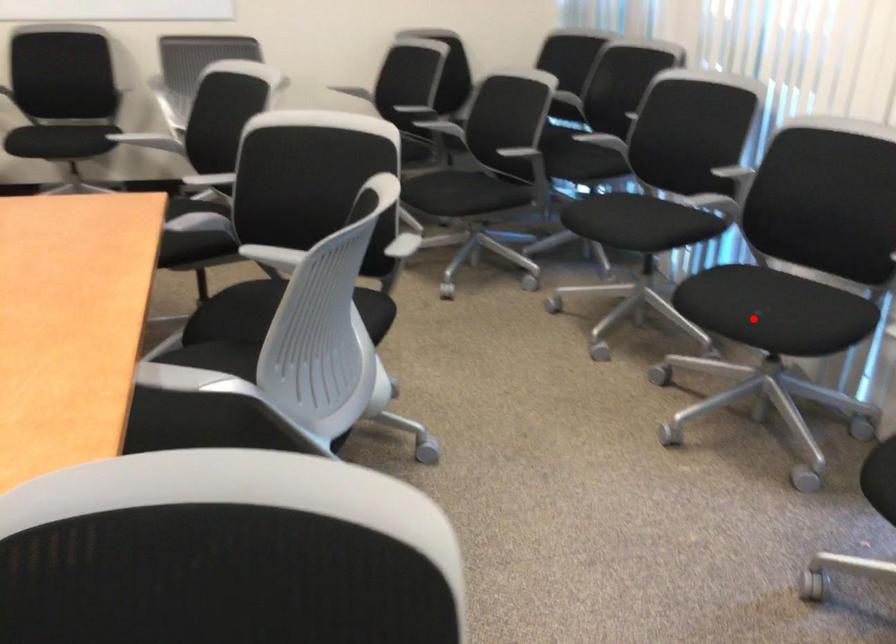
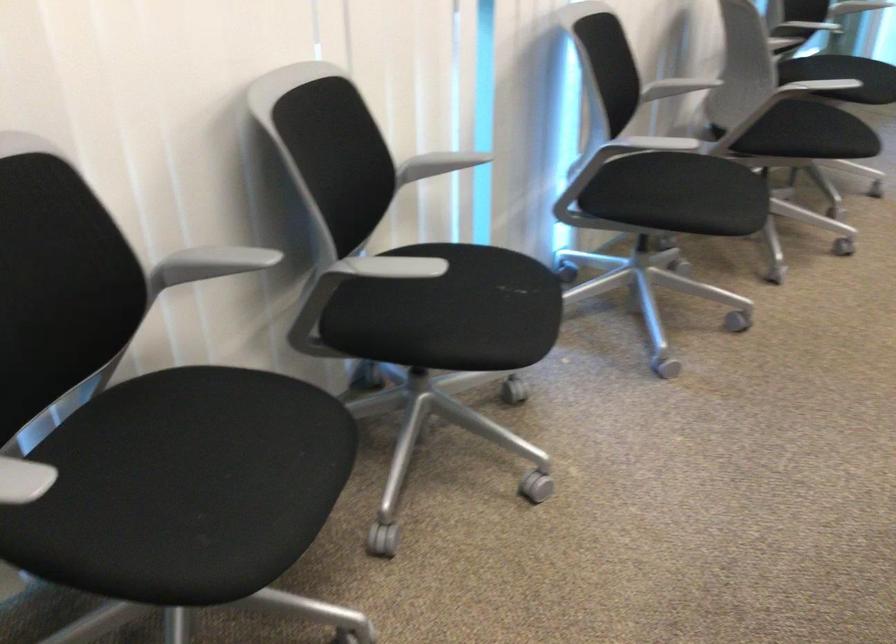
Question: I am providing you with two images of the same scene from different viewpoints. A red point is shown in image1. For the corresponding object point in image2, is it positioned nearer or farther from the camera?

Choices:
 (A) Nearer
 (B) Farther

Answer: (A)